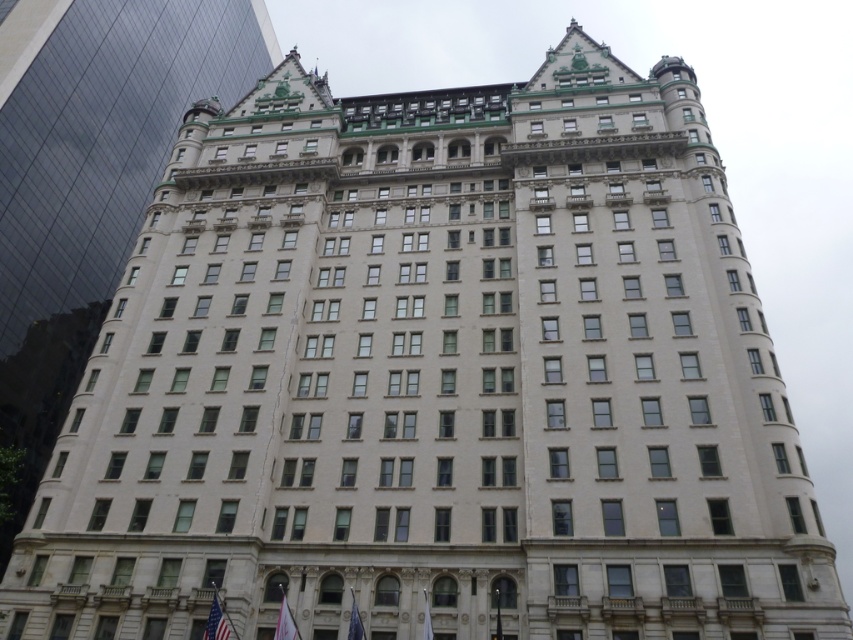
You are standing in front of the grand building and notice two flags at the lower center. Which flag is positioned lower between the white fabric flag at lower center and the blue fabric flag at lower center?

The white fabric flag at lower center is positioned below the blue fabric flag at lower center, so the white fabric flag at lower center is lower.

You are standing in front of the grand building and notice two points marked on its facade. The first point is at coordinate point (277, 625) and the second is at point (352, 600). From your perspective, which point appears closer to you?

Point (277, 625) is in front of point (352, 600), so it appears closer to you.

You are standing in front of the grand building and notice two flags. The American flag at lower left and the white fabric flag at lower center. Which flag is positioned higher relative to the other?

The American flag at lower left is positioned higher than the white fabric flag at lower center because it is above it.